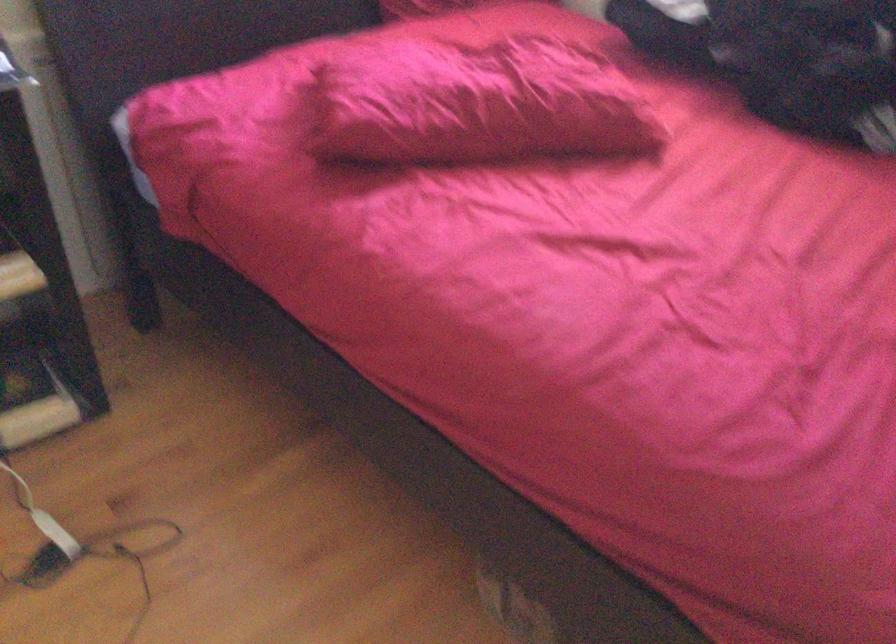
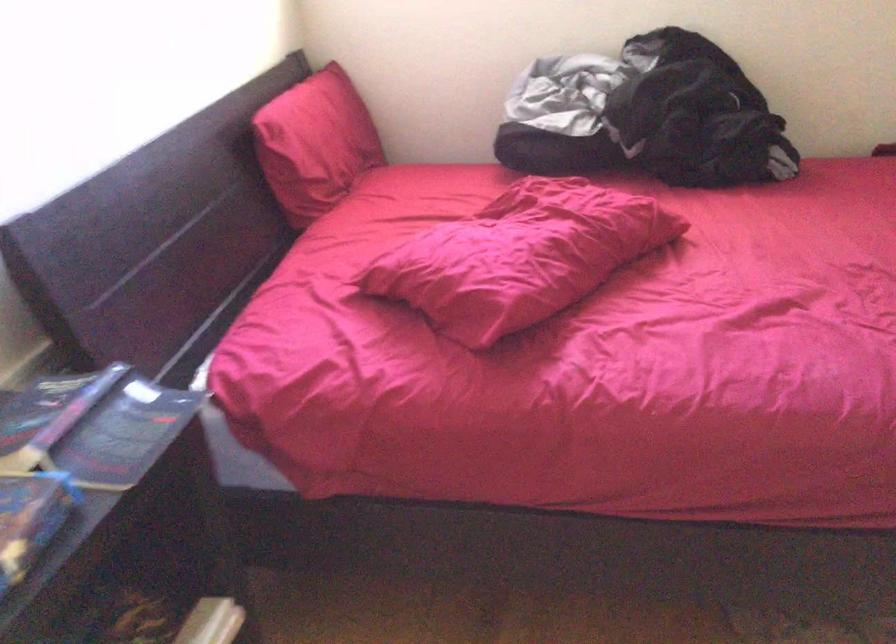
Find the pixel in the second image that matches [412,90] in the first image.

(520, 257)